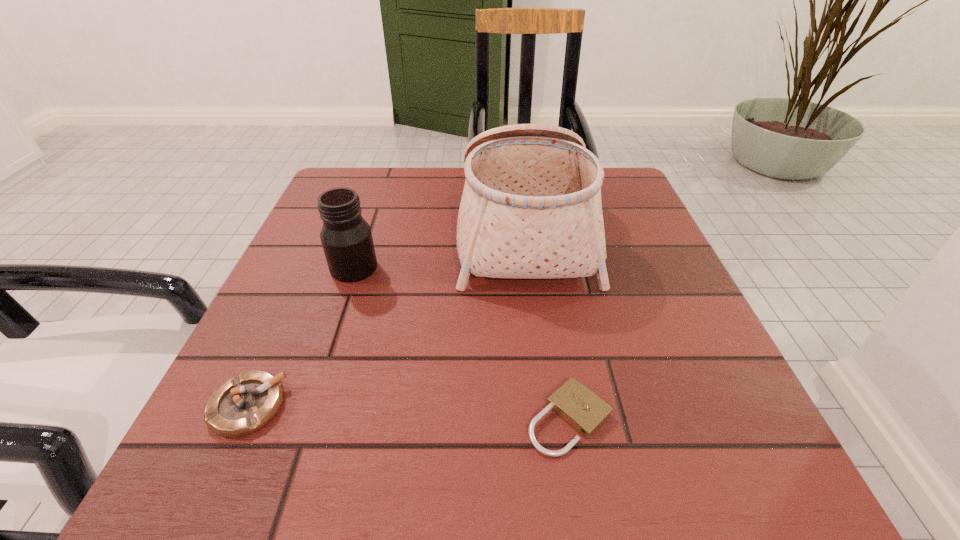
Image resolution: width=960 pixels, height=540 pixels. Identify the location of object located at the far edge. 531,208.

I want to click on ashtray that is positioned at the near edge, so click(243, 405).

I want to click on padlock situated at the near edge, so (585, 411).

At what (x,y) coordinates should I click in order to perform the action: click on jar that is at the left edge. Please return your answer as a coordinate pair (x, y). Image resolution: width=960 pixels, height=540 pixels. Looking at the image, I should click on (346, 237).

Find the location of a particular element. This screenshot has height=540, width=960. ashtray situated at the left edge is located at coordinates (243, 405).

Locate an element on the screen. The height and width of the screenshot is (540, 960). object that is at the right edge is located at coordinates (531, 208).

Image resolution: width=960 pixels, height=540 pixels. What are the coordinates of `object that is at the near left corner` in the screenshot? It's located at (243, 405).

Find the location of a particular element. The height and width of the screenshot is (540, 960). object present at the far right corner is located at coordinates (531, 208).

Locate an element on the screen. The height and width of the screenshot is (540, 960). vacant point at the near edge is located at coordinates (579, 480).

At what (x,y) coordinates should I click in order to perform the action: click on free space at the left edge of the desktop. Please return your answer as a coordinate pair (x, y). Looking at the image, I should click on (308, 219).